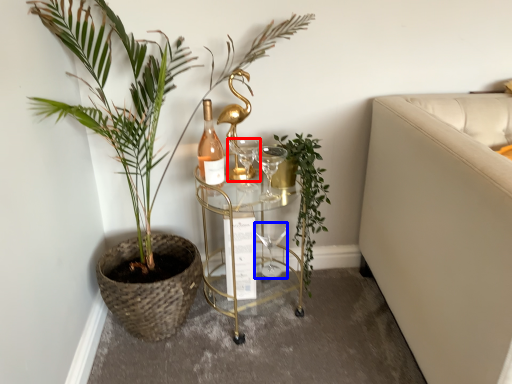
Question: Among these objects, which one is farthest to the camera, wine glass (highlighted by a red box) or wine glass (highlighted by a blue box)?

Choices:
 (A) wine glass
 (B) wine glass

Answer: (B)